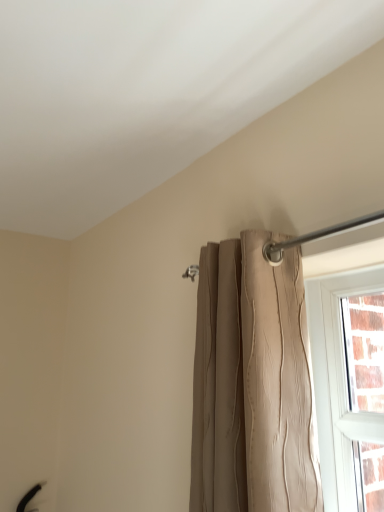
This screenshot has width=384, height=512. What do you see at coordinates (334, 376) in the screenshot? I see `beige fabric curtain at upper right` at bounding box center [334, 376].

From the picture: What is the approximate height of beige fabric curtain at upper right?

beige fabric curtain at upper right is 56.25 centimeters tall.

Locate an element on the screen. beige fabric curtain at upper right is located at coordinates (334, 376).

Locate an element on the screen. beige fabric curtain at upper right is located at coordinates (334, 376).